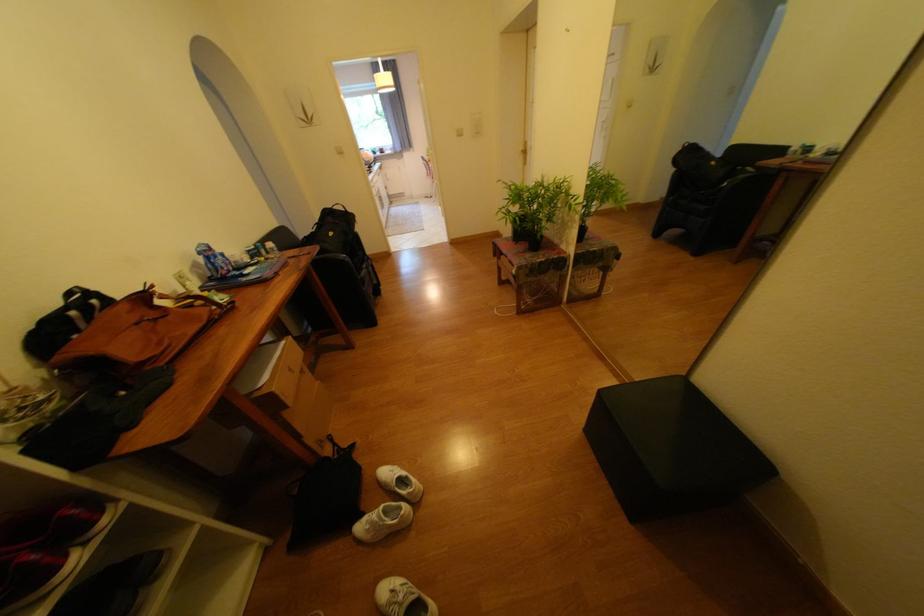
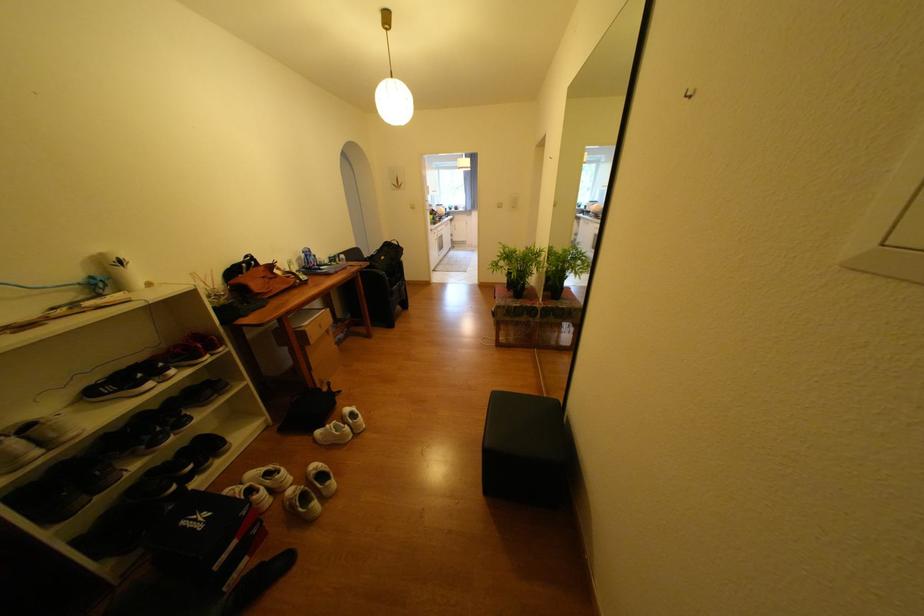
The point at (341, 233) is marked in the first image. Where is the corresponding point in the second image?

(392, 257)